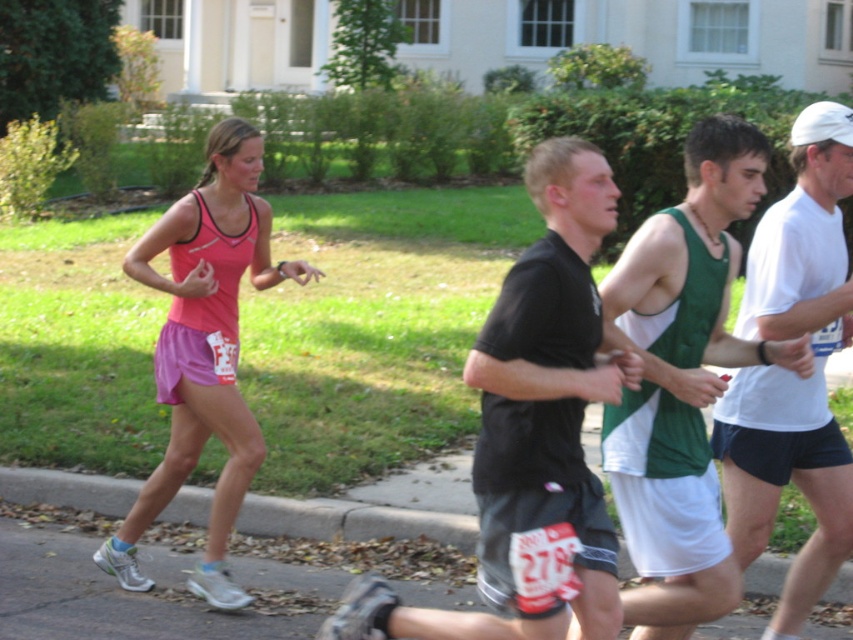
You are observing a road race with four runners. You notice a runner wearing a green tank top at center. Where is this runner positioned relative to the other runners in the race?

The green tank top at center is located at point (682, 378), which places it centrally among the runners, indicating it is in the middle of the pack.

You are standing at the starting line of the race and see the green tank top at center and the red tank top at the back. How far apart are they?

The green tank top at center and the red tank top at back are 4.47 meters apart.

You are a photographer standing behind the runners and want to capture both the white matte shorts at right and the pink fabric tank top at left in the same frame. Which object should you focus on first to ensure both are in focus?

You should focus on the pink fabric tank top at left first because it is higher up, so focusing on it will also keep the white matte shorts at right in focus.